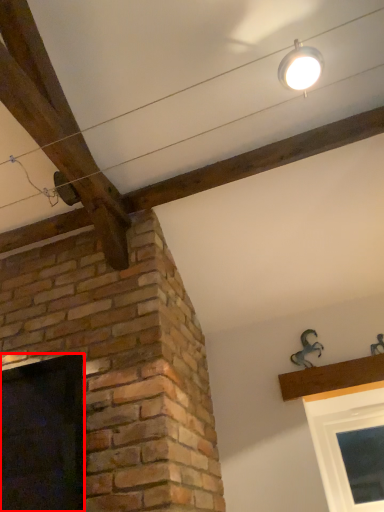
Question: From the image's perspective, what is the correct spatial positioning of window (annotated by the red box) in reference to light fixture?

Choices:
 (A) above
 (B) below

Answer: (B)